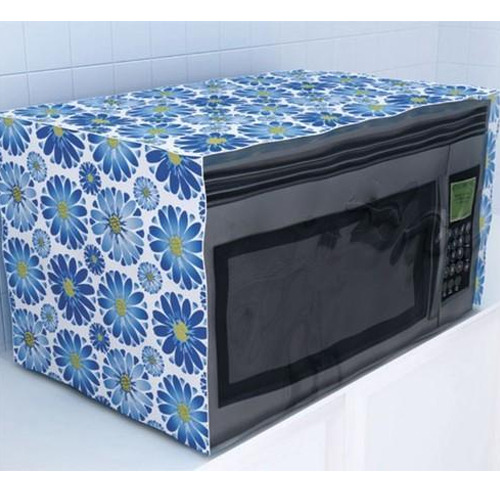
Where is `window of door`? The width and height of the screenshot is (500, 500). window of door is located at coordinates (250, 279), (397, 243), (409, 311), (252, 355).